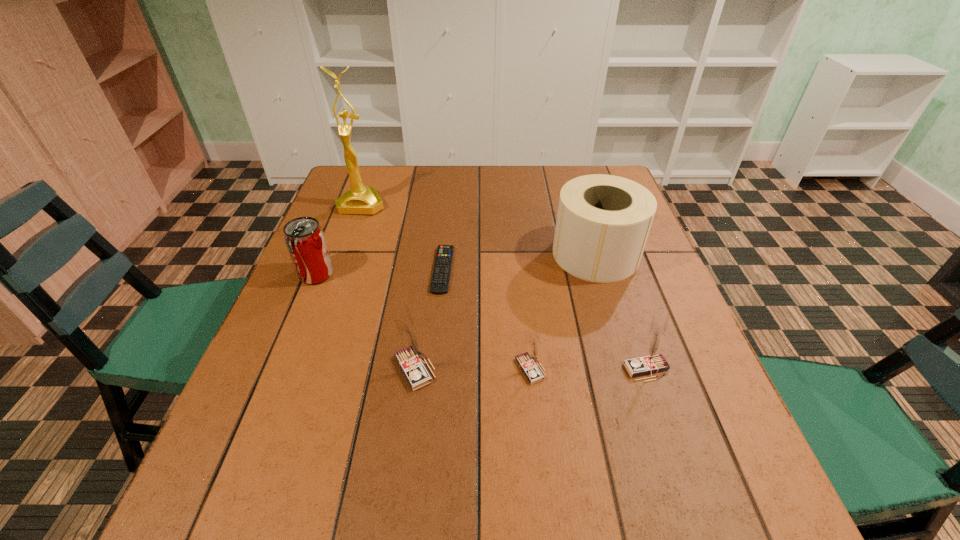
Where is `the leftmost matchbox`? The width and height of the screenshot is (960, 540). the leftmost matchbox is located at coordinates (x=409, y=358).

Locate an element on the screen. The width and height of the screenshot is (960, 540). the shortest matchbox is located at coordinates (528, 361).

At what (x,y) coordinates should I click in order to perform the action: click on the third object from right to left. Please return your answer as a coordinate pair (x, y). The height and width of the screenshot is (540, 960). Looking at the image, I should click on (528, 361).

The height and width of the screenshot is (540, 960). Find the location of `the second tallest matchbox`. the second tallest matchbox is located at coordinates (652, 361).

Find the location of a particular element. remote control is located at coordinates (442, 268).

Locate an element on the screen. Image resolution: width=960 pixels, height=540 pixels. toilet tissue is located at coordinates (603, 221).

Locate an element on the screen. award is located at coordinates (360, 199).

Where is `the farthest object`? the farthest object is located at coordinates (360, 199).

Where is `pop soda`? This screenshot has width=960, height=540. pop soda is located at coordinates (304, 237).

Find the location of a particular element. free space located on the back of the leftmost matchbox is located at coordinates (430, 251).